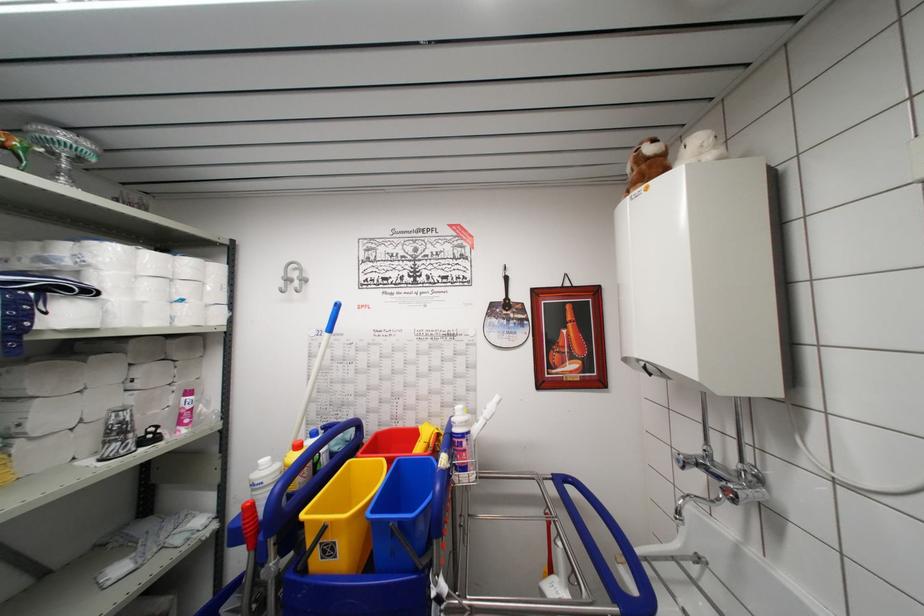
The location [343,517] corresponds to which object?

This point indicates the yellow bucket.